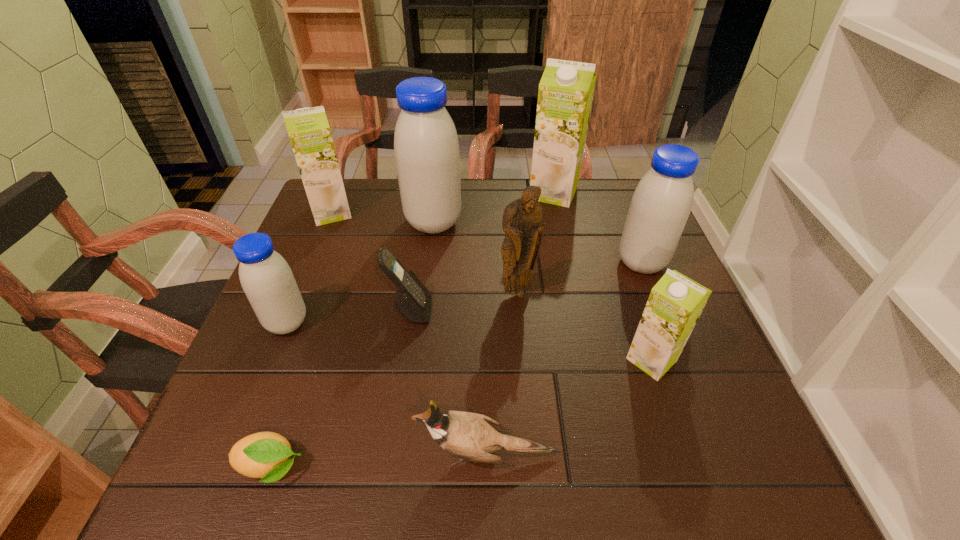
This screenshot has width=960, height=540. Find the location of `cellular telephone`. cellular telephone is located at coordinates (413, 301).

You are a GUI agent. You are given a task and a screenshot of the screen. Output one action in this format:
    pyautogui.click(x=<x>, y=<y>)
    Task: Click on the bird
    The image size is (960, 540).
    Given the screenshot: What is the action you would take?
    pyautogui.click(x=469, y=436)

Where is `the shortest object`? Image resolution: width=960 pixels, height=540 pixels. the shortest object is located at coordinates (266, 455).

The image size is (960, 540). I want to click on lemon, so click(x=266, y=455).

I want to click on free region located on the left of the biggest green soya milk, so click(x=441, y=193).

The height and width of the screenshot is (540, 960). Identify the location of blank area located on the right of the farthest blue soya milk. (539, 222).

Find the location of a particular element. This screenshot has width=960, height=540. vacant region located 0.120m on the back of the leftmost green soya milk is located at coordinates pyautogui.click(x=346, y=178).

Image resolution: width=960 pixels, height=540 pixels. What are the coordinates of `free space located on the front of the fourth farthest object` in the screenshot? It's located at (659, 305).

Where is `vacant space located 0.390m on the front-facing side of the figurine`? vacant space located 0.390m on the front-facing side of the figurine is located at coordinates (533, 474).

Where is `free region located 0.270m on the back of the smallest blue soya milk`? This screenshot has width=960, height=540. free region located 0.270m on the back of the smallest blue soya milk is located at coordinates 324,232.